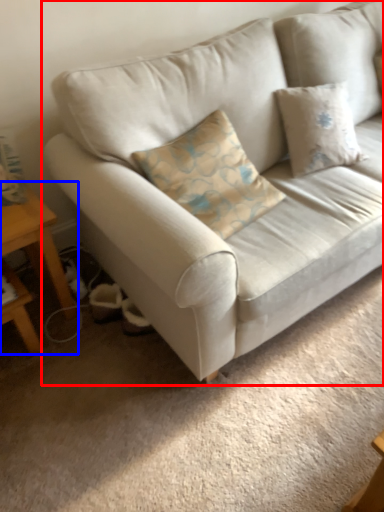
Question: Among these objects, which one is farthest to the camera, studio couch (highlighted by a red box) or table (highlighted by a blue box)?

Choices:
 (A) studio couch
 (B) table

Answer: (B)